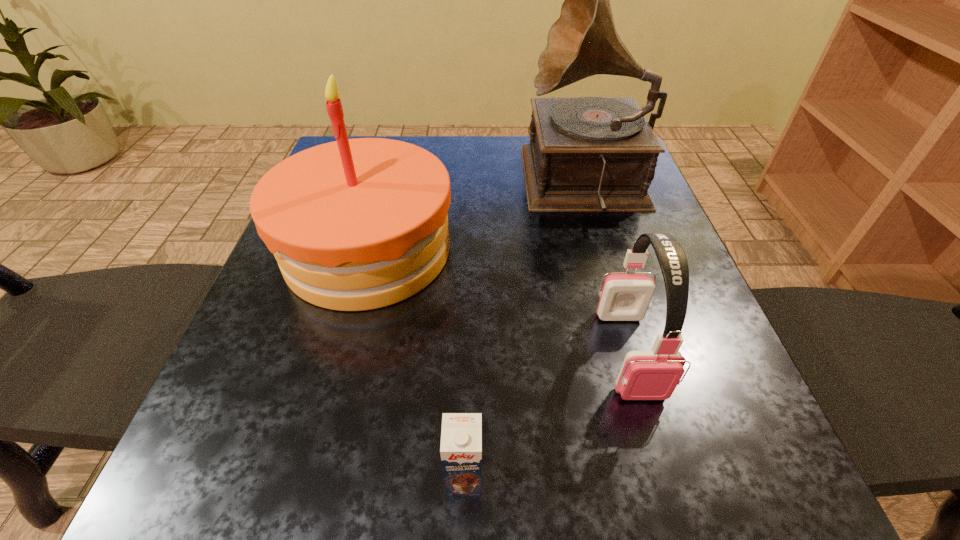
In the image, there is a desktop. Identify the location of vacant area at the right edge. The width and height of the screenshot is (960, 540). (609, 259).

This screenshot has height=540, width=960. What are the coordinates of `vacant point at the near left corner` in the screenshot? It's located at (195, 466).

Where is `free spot between the third tallest object and the record player`? free spot between the third tallest object and the record player is located at coordinates (608, 268).

Locate an element on the screen. The width and height of the screenshot is (960, 540). free space between the earphone and the birthday cake is located at coordinates (498, 301).

Identify the location of free space between the leftmost object and the tallest object. (477, 217).

You are a GUI agent. You are given a task and a screenshot of the screen. Output one action in this format:
    pyautogui.click(x=<x>, y=<y>)
    Task: Click on the free space between the record player and the chocolate milk
    Image resolution: width=960 pixels, height=540 pixels.
    Given the screenshot: What is the action you would take?
    pyautogui.click(x=525, y=331)

Where is `vacant area between the third tallest object and the birthday cake`? vacant area between the third tallest object and the birthday cake is located at coordinates (498, 301).

This screenshot has height=540, width=960. I want to click on unoccupied area between the leftmost object and the third tallest object, so 498,301.

Image resolution: width=960 pixels, height=540 pixels. I want to click on empty space that is in between the earphone and the chocolate milk, so click(546, 415).

Identify the location of vacant area that lies between the tallest object and the earphone. Image resolution: width=960 pixels, height=540 pixels. (608, 268).